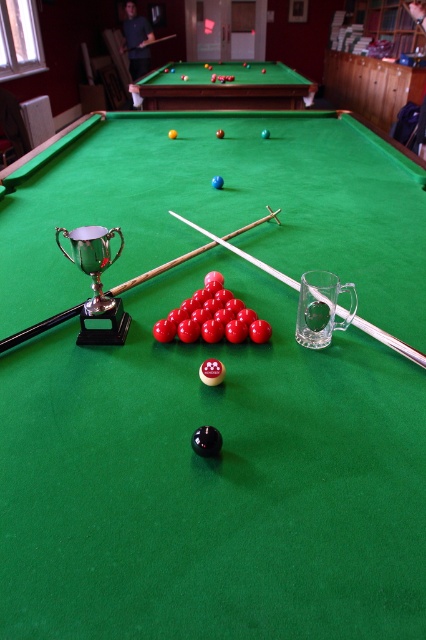
Question: Can you confirm if green felt billiard table at center is wider than clear wood cue at center?

Choices:
 (A) no
 (B) yes

Answer: (A)

Question: From the image, what is the correct spatial relationship of white wood cue at center in relation to clear wood cue at center?

Choices:
 (A) right
 (B) left

Answer: (B)

Question: Which object is positioned farthest from the green felt billiard table at center?

Choices:
 (A) white wood cue at center
 (B) green felt pool table at upper center
 (C) clear wood cue at center

Answer: (B)

Question: Which of the following is the farthest from the observer?

Choices:
 (A) (342, 314)
 (B) (141, 273)
 (C) (175, 212)
 (D) (187, 68)

Answer: (D)

Question: Does green felt billiard table at center have a lesser width compared to white wood cue at center?

Choices:
 (A) yes
 (B) no

Answer: (A)

Question: Estimate the real-world distances between objects in this image. Which object is closer to the white wood cue at center?

Choices:
 (A) clear wood cue at center
 (B) green felt pool table at upper center

Answer: (A)